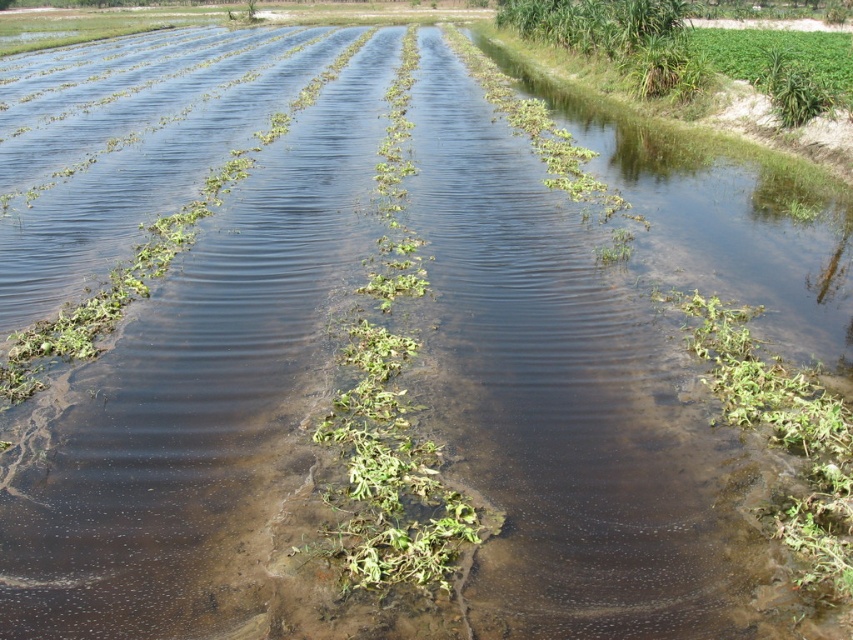
You are standing at the origin point of the field and want to reach the green leafy plant at center. According to the coordinates provided, in which direction should you move to reach it?

The green leafy plant at center is located at coordinates point (x=392, y=474), so you should move towards the right and slightly forward to reach it.

You are standing at the edge of the flooded agricultural field and see two points marked in the image. The first point is at coordinates point (430, 499) and the second is at point (805, 572). Which point is closer to you?

Point (430, 499) is further to the camera than point (805, 572), so the point closer to you is point (805, 572).